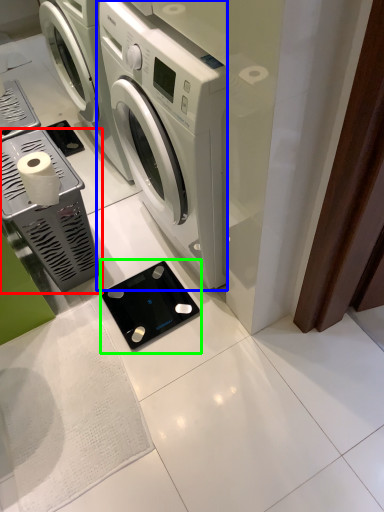
Question: Which is farther away from appliance (highlighted by a red box)? washing machine (highlighted by a blue box) or appliance (highlighted by a green box)?

Choices:
 (A) washing machine
 (B) appliance

Answer: (A)